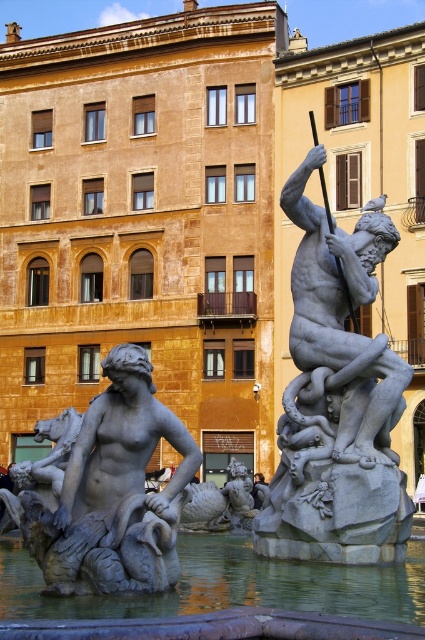
Question: Which object appears farthest from the camera in this image?

Choices:
 (A) gray stone statue at center
 (B) clear water at center

Answer: (A)

Question: Which of these objects is positioned closest to the matte gray statue at center?

Choices:
 (A) clear water at center
 (B) gray stone statue at center

Answer: (A)

Question: Is matte gray statue at center bigger than clear water at center?

Choices:
 (A) yes
 (B) no

Answer: (B)

Question: Does matte gray statue at center appear on the left side of clear water at center?

Choices:
 (A) yes
 (B) no

Answer: (A)

Question: Is gray stone statue at center wider than clear water at center?

Choices:
 (A) yes
 (B) no

Answer: (B)

Question: Among these objects, which one is farthest from the camera?

Choices:
 (A) gray stone statue at center
 (B) clear water at center
 (C) matte gray statue at center

Answer: (A)